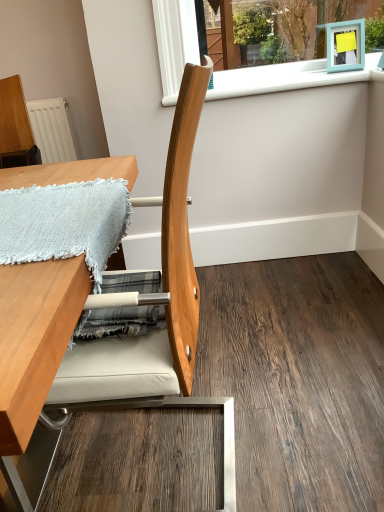
Question: Should I look upward or downward to see light blue woven blanket at upper left?

Choices:
 (A) up
 (B) down

Answer: (A)

Question: Can you confirm if white plastic window sill at upper center is thinner than light blue woven blanket at upper left?

Choices:
 (A) no
 (B) yes

Answer: (B)

Question: Can you confirm if white plastic window sill at upper center is smaller than light blue woven blanket at upper left?

Choices:
 (A) no
 (B) yes

Answer: (A)

Question: Does white plastic window sill at upper center have a greater height compared to light blue woven blanket at upper left?

Choices:
 (A) no
 (B) yes

Answer: (B)

Question: Can you confirm if white plastic window sill at upper center is positioned to the right of light blue woven blanket at upper left?

Choices:
 (A) yes
 (B) no

Answer: (A)

Question: Is white plastic window sill at upper center further to camera compared to light blue woven blanket at upper left?

Choices:
 (A) yes
 (B) no

Answer: (A)

Question: Does white plastic window sill at upper center appear on the left side of light blue woven blanket at upper left?

Choices:
 (A) yes
 (B) no

Answer: (B)

Question: Does natural wood chair at center turn towards light blue woven blanket at upper left?

Choices:
 (A) yes
 (B) no

Answer: (A)

Question: Can you confirm if natural wood chair at center is positioned to the left of light blue woven blanket at upper left?

Choices:
 (A) no
 (B) yes

Answer: (A)

Question: Is natural wood chair at center not near light blue woven blanket at upper left?

Choices:
 (A) no
 (B) yes

Answer: (A)

Question: Can we say natural wood chair at center lies outside light blue woven blanket at upper left?

Choices:
 (A) no
 (B) yes

Answer: (B)

Question: Does natural wood chair at center have a lesser width compared to light blue woven blanket at upper left?

Choices:
 (A) no
 (B) yes

Answer: (A)

Question: Is light blue woven blanket at upper left completely or partially inside natural wood chair at center?

Choices:
 (A) yes
 (B) no

Answer: (A)

Question: From a real-world perspective, is natural wood chair at center below white plastic window sill at upper center?

Choices:
 (A) no
 (B) yes

Answer: (B)